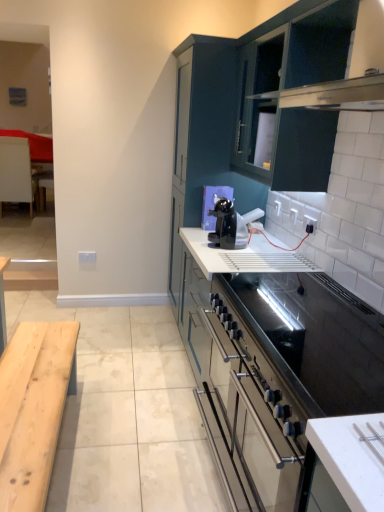
Where is `free spot in front of black glossy coffee machine at center`? free spot in front of black glossy coffee machine at center is located at coordinates (223, 252).